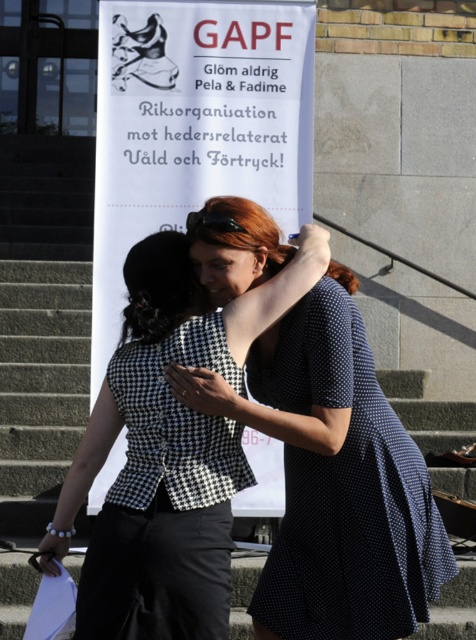
You are an event photographer who just arrived at the scene. You need to position yourself so that you can capture both the black checkered blouse at center and the black houndstooth fabric dress at center in the same frame. Which side should you stand relative to the subjects to ensure both are visible?

You should stand to the left of the subjects because the black checkered blouse at center is to the right of the black houndstooth fabric dress at center. By positioning yourself to the left, you can capture both in the frame.

What is the relationship between the positions of the black checkered blouse at center and the black houndstooth fabric dress at center in the image?

The black houndstooth fabric dress at center is positioned behind the black checkered blouse at center, so the dress is not visible from the front perspective.

From the picture: What is the position of the dark blue dotted dress at center relative to the point marked at coordinates (345, 490)?

The dark blue dotted dress at center is located exactly at the point marked by the coordinates (345, 490).